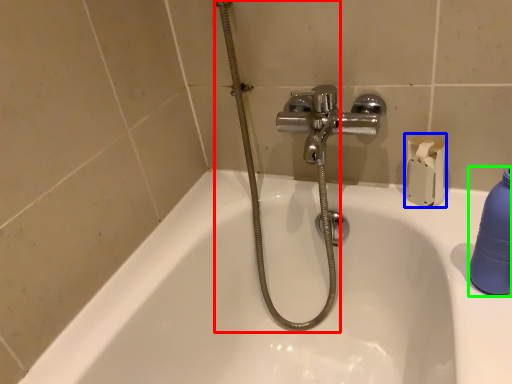
Question: Considering the real-world distances, which object is farthest from shower (highlighted by a red box)? toilet paper (highlighted by a blue box) or cleaning product (highlighted by a green box)?

Choices:
 (A) toilet paper
 (B) cleaning product

Answer: (B)